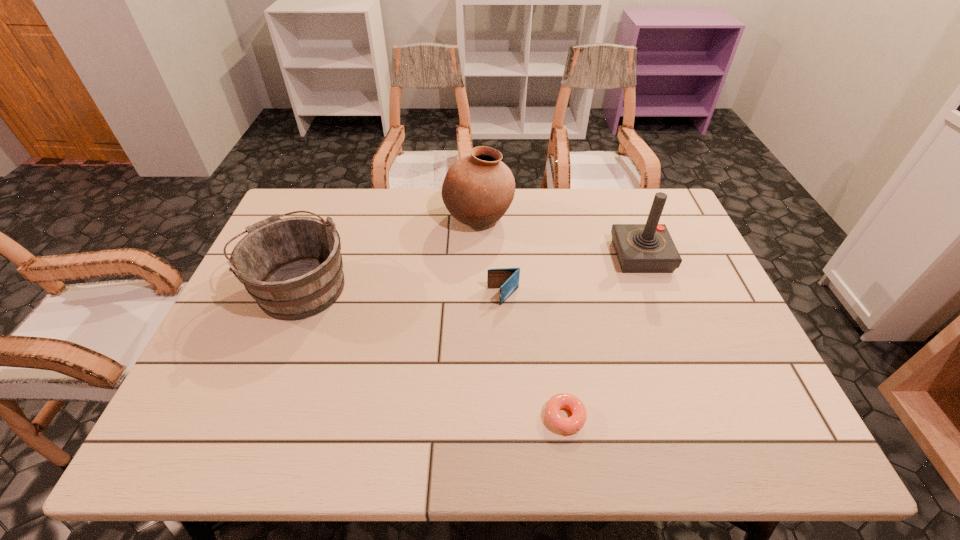
Where is `blank space that satisfies the following two spatial constraints: 1. on the back side of the pottery; 2. on the right side of the third shortest object`? This screenshot has height=540, width=960. blank space that satisfies the following two spatial constraints: 1. on the back side of the pottery; 2. on the right side of the third shortest object is located at coordinates (325, 219).